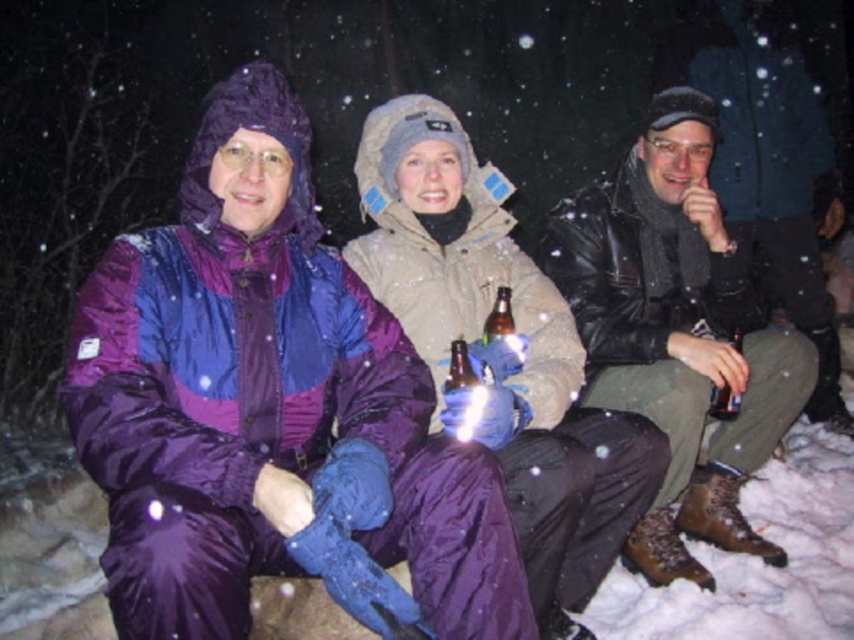
Question: Which of the following is the farthest from the observer?

Choices:
 (A) beige fleece jacket at center
 (B) brown glass bottle at center

Answer: (B)

Question: Where is purple nylon jacket at center located in relation to brown glass bottle at center in the image?

Choices:
 (A) above
 (B) below

Answer: (B)

Question: Which point is farther to the camera?

Choices:
 (A) black plastic bottle at center
 (B) purple nylon jacket at center

Answer: (A)

Question: From the image, what is the correct spatial relationship of beige fleece jacket at center in relation to brown glass bottle at center?

Choices:
 (A) above
 (B) below

Answer: (B)

Question: Can you confirm if purple nylon jacket at center is positioned below black plastic bottle at center?

Choices:
 (A) yes
 (B) no

Answer: (B)

Question: Which of these objects is positioned farthest from the beige fleece jacket at center?

Choices:
 (A) leather jacket at right
 (B) purple nylon jacket at center

Answer: (A)